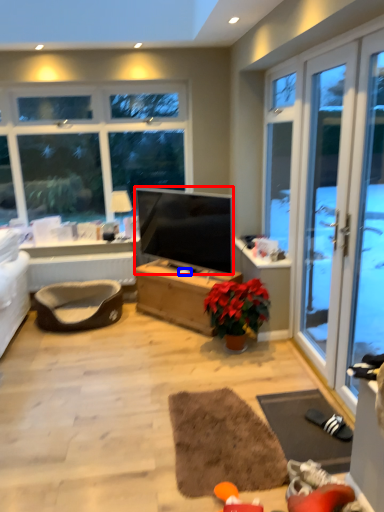
Question: Which object is further to the camera taking this photo, television (highlighted by a red box) or loudspeaker (highlighted by a blue box)?

Choices:
 (A) television
 (B) loudspeaker

Answer: (B)